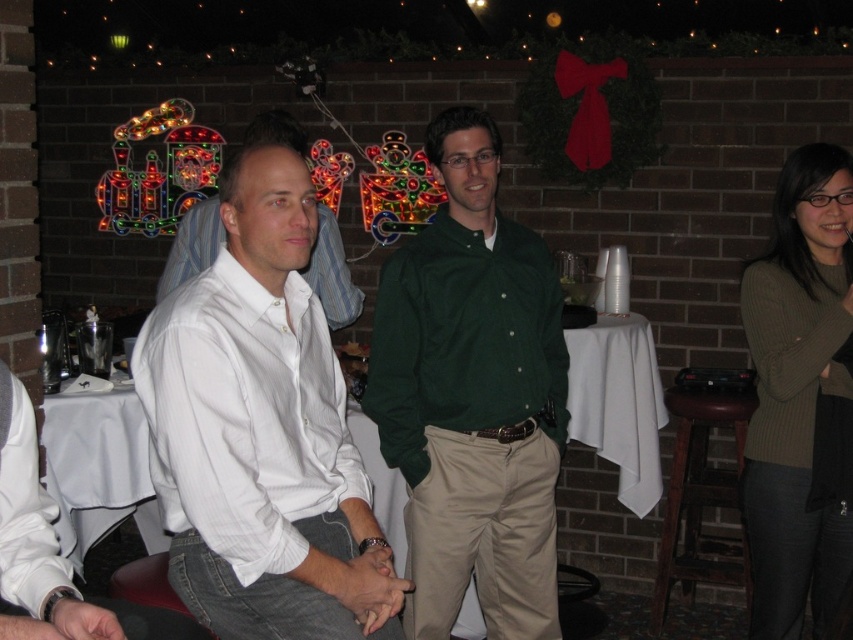
Question: Which object is farther from the camera taking this photo?

Choices:
 (A) white matte shirt at left
 (B) white cotton shirt at center
 (C) brown wooden stool at lower right
 (D) knit green sweater at right

Answer: (C)

Question: Among these points, which one is farthest from the camera?

Choices:
 (A) (457, 492)
 (B) (161, 285)

Answer: (B)

Question: Can you confirm if white cotton shirt at center is smaller than white matte shirt at left?

Choices:
 (A) no
 (B) yes

Answer: (A)

Question: Can you confirm if white cotton shirt at center is positioned to the left of brown wooden stool at lower right?

Choices:
 (A) yes
 (B) no

Answer: (A)

Question: Is knit green sweater at right thinner than white matte shirt at left?

Choices:
 (A) no
 (B) yes

Answer: (A)

Question: Which point is farther to the camera?

Choices:
 (A) (677, 554)
 (B) (209, 253)
 (C) (305, 540)

Answer: (A)